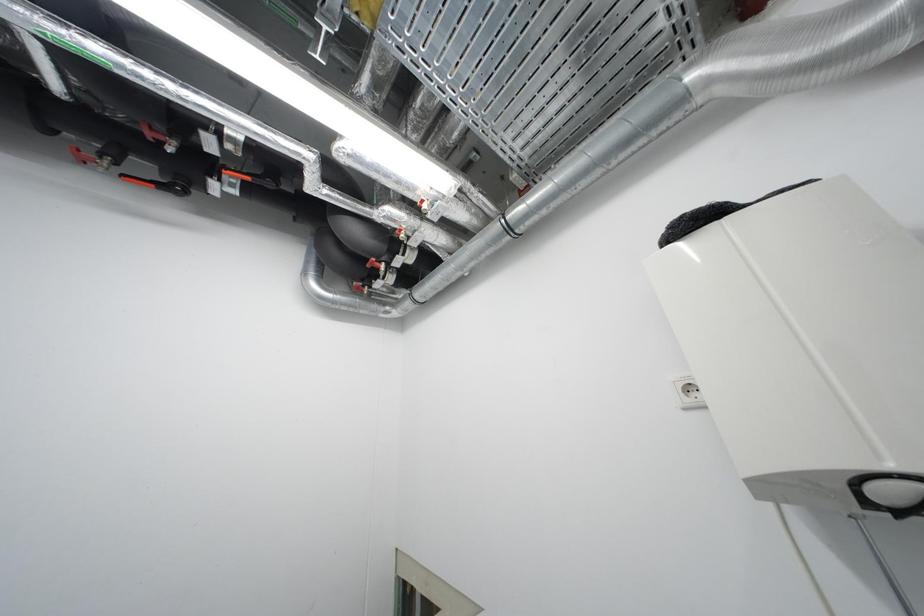
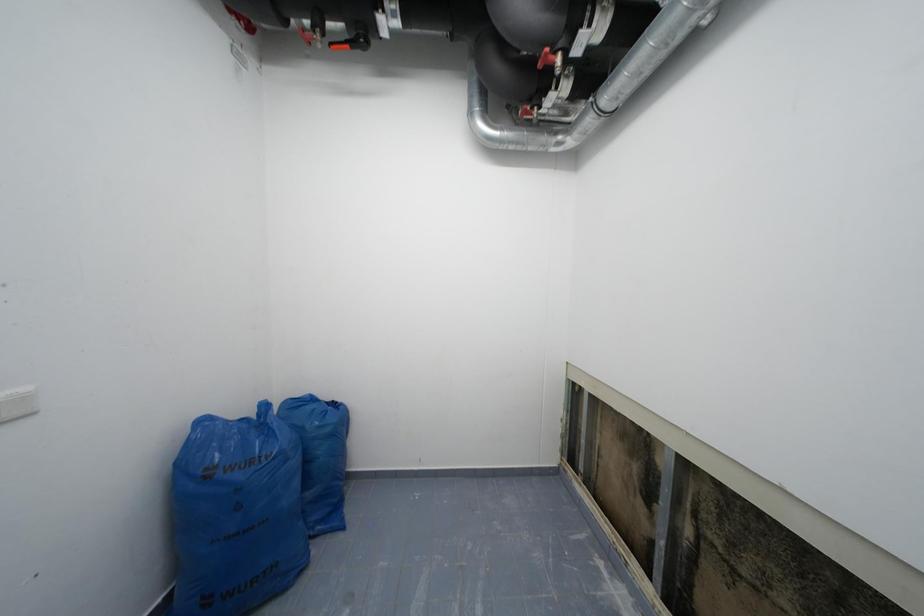
First-person continuous shooting, in which direction is the camera rotating?

The camera rotated toward left-down.